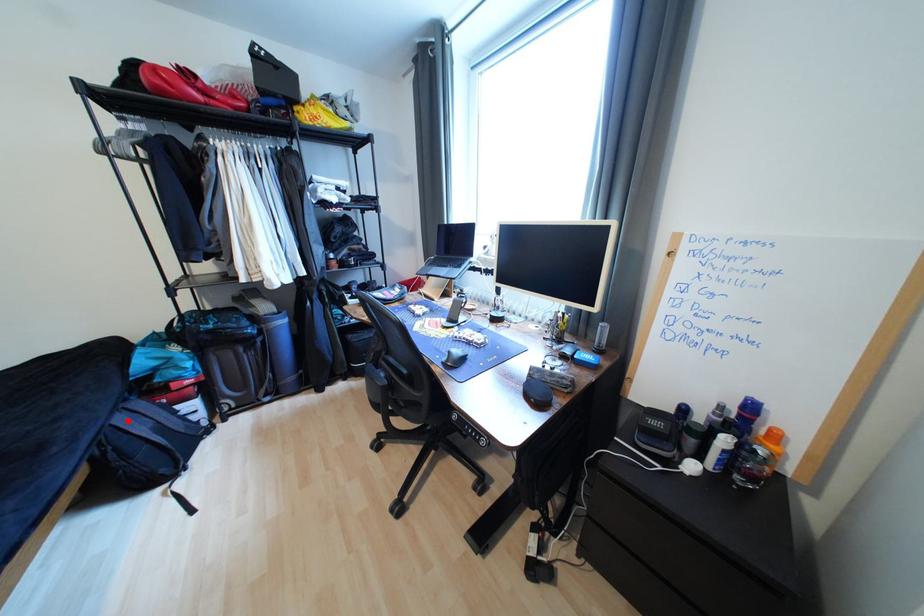
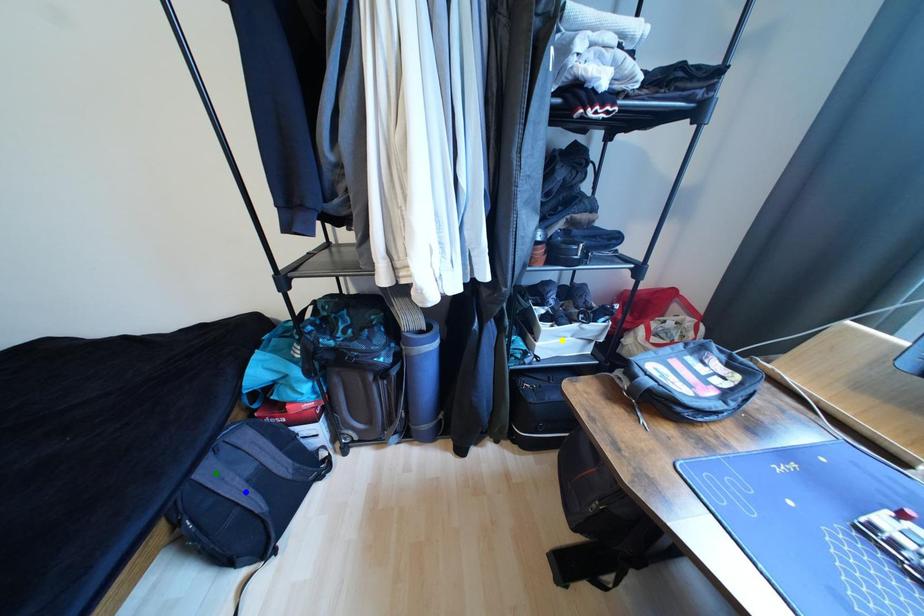
Question: I am providing you with two images of the same scene from different viewpoints. A red point is marked on the first image. You are given multiple points on the second image. Which point in image 2 represents the same 3d spot as the red point in image 1?

Choices:
 (A) blue point
 (B) yellow point
 (C) green point

Answer: (C)